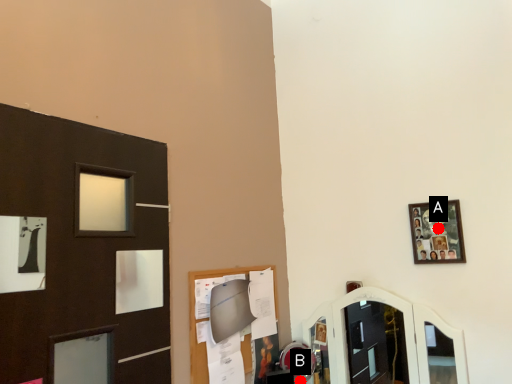
Question: Two points are circled on the image, labeled by A and B beside each circle. Which point is closer to the camera?

Choices:
 (A) A is closer
 (B) B is closer

Answer: (A)